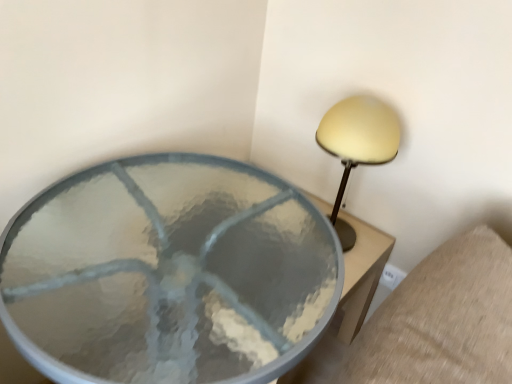
Describe the element at coordinates (357, 144) in the screenshot. I see `matte yellow lampshade at upper right` at that location.

What is the approximate width of matte yellow lampshade at upper right?

7.03 inches.

Identify the location of matte yellow lampshade at upper right. [x=357, y=144].

This screenshot has height=384, width=512. Identify the location of clear glass table at center. (168, 273).

Describe the element at coordinates (168, 273) in the screenshot. I see `clear glass table at center` at that location.

At what (x,y) coordinates should I click in order to perform the action: click on matte yellow lampshade at upper right. Please return your answer as a coordinate pair (x, y). This screenshot has width=512, height=384. Looking at the image, I should click on (357, 144).

Which is more to the right, matte yellow lampshade at upper right or clear glass table at center?

From the viewer's perspective, matte yellow lampshade at upper right appears more on the right side.

Which is behind, matte yellow lampshade at upper right or clear glass table at center?

matte yellow lampshade at upper right is further away from the camera.

Is point (344, 179) closer to camera compared to point (106, 261)?

No, (344, 179) is behind (106, 261).

From the image's perspective, which object appears higher, matte yellow lampshade at upper right or clear glass table at center?

matte yellow lampshade at upper right appears higher in the image.

From a real-world perspective, is matte yellow lampshade at upper right under clear glass table at center?

Incorrect, from a real-world perspective, matte yellow lampshade at upper right is higher than clear glass table at center.

Considering the sizes of objects matte yellow lampshade at upper right and clear glass table at center in the image provided, who is wider, matte yellow lampshade at upper right or clear glass table at center?

With larger width is clear glass table at center.

Considering the relative sizes of matte yellow lampshade at upper right and clear glass table at center in the image provided, is matte yellow lampshade at upper right taller than clear glass table at center?

No.

Between matte yellow lampshade at upper right and clear glass table at center, which one has smaller size?

With smaller size is matte yellow lampshade at upper right.

Is matte yellow lampshade at upper right situated inside clear glass table at center or outside?

matte yellow lampshade at upper right is located beyond the bounds of clear glass table at center.

Based on the photo, are matte yellow lampshade at upper right and clear glass table at center making contact?

No, matte yellow lampshade at upper right is not making contact with clear glass table at center.

Does matte yellow lampshade at upper right turn towards clear glass table at center?

Yes, matte yellow lampshade at upper right is aimed at clear glass table at center.

Can you tell me how much matte yellow lampshade at upper right and clear glass table at center differ in facing direction?

The angle between the facing direction of matte yellow lampshade at upper right and the facing direction of clear glass table at center is 88.8 degrees.

Measure the distance between matte yellow lampshade at upper right and clear glass table at center.

matte yellow lampshade at upper right and clear glass table at center are 16.28 inches apart.

The image size is (512, 384). What are the coordinates of `table below the matte yellow lampshade at upper right (from a real-world perspective)` in the screenshot? It's located at (168, 273).

Based on their positions, is clear glass table at center located to the left or right of matte yellow lampshade at upper right?

Based on their positions, clear glass table at center is located to the left of matte yellow lampshade at upper right.

Is clear glass table at center in front of or behind matte yellow lampshade at upper right in the image?

clear glass table at center is in front of matte yellow lampshade at upper right.

Does point (192, 167) appear closer or farther from the camera than point (343, 182)?

Point (192, 167) appears to be closer to the viewer than point (343, 182).

From the image's perspective, is clear glass table at center above matte yellow lampshade at upper right?

No, from the image's perspective, clear glass table at center is not over matte yellow lampshade at upper right.

From a real-world perspective, is clear glass table at center over matte yellow lampshade at upper right?

No, from a real-world perspective, clear glass table at center is not on top of matte yellow lampshade at upper right.

Based on the photo, considering the sizes of objects clear glass table at center and matte yellow lampshade at upper right in the image provided, who is thinner, clear glass table at center or matte yellow lampshade at upper right?

matte yellow lampshade at upper right.

Which of these two, clear glass table at center or matte yellow lampshade at upper right, stands shorter?

matte yellow lampshade at upper right is shorter.

Which of these two, clear glass table at center or matte yellow lampshade at upper right, is bigger?

With larger size is clear glass table at center.

Is matte yellow lampshade at upper right surrounded by clear glass table at center?

No, matte yellow lampshade at upper right is located outside of clear glass table at center.

Does clear glass table at center touch matte yellow lampshade at upper right?

No, clear glass table at center is not in contact with matte yellow lampshade at upper right.

Is clear glass table at center oriented away from matte yellow lampshade at upper right?

No, clear glass table at center's orientation is not away from matte yellow lampshade at upper right.

You are a GUI agent. You are given a task and a screenshot of the screen. Output one action in this format:
    pyautogui.click(x=<x>, y=<y>)
    Task: Click on the lamp on the right of the clear glass table at center
    
    Given the screenshot: What is the action you would take?
    357,144

Find the location of a particular element. The width and height of the screenshot is (512, 384). table located on the left of matte yellow lampshade at upper right is located at coordinates (168, 273).

You are a GUI agent. You are given a task and a screenshot of the screen. Output one action in this format:
    pyautogui.click(x=<x>, y=<y>)
    Task: Click on the lamp behind the clear glass table at center
    The width and height of the screenshot is (512, 384).
    Given the screenshot: What is the action you would take?
    pyautogui.click(x=357, y=144)